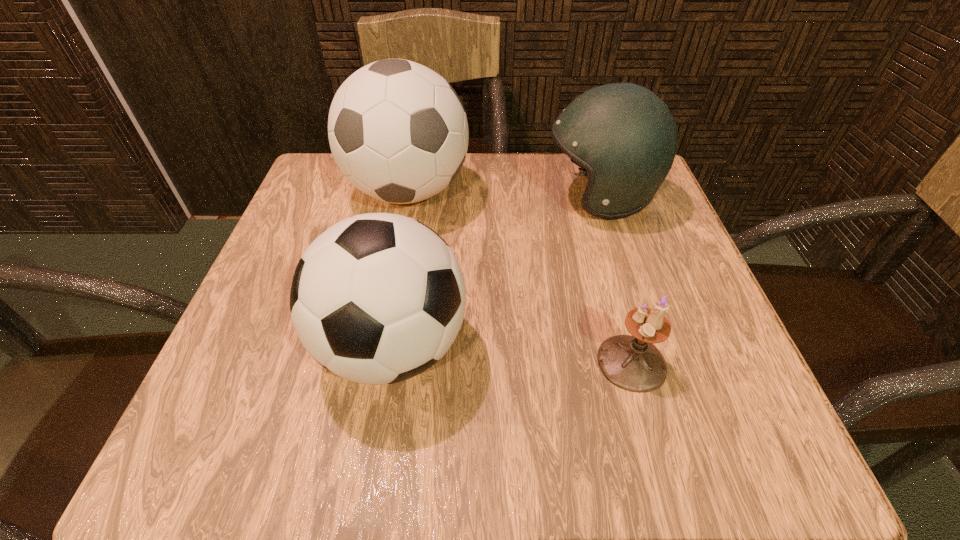
Locate an element on the screen. the farther soccer ball is located at coordinates (398, 131).

At what (x,y) coordinates should I click in order to perform the action: click on football helmet. Please return your answer as a coordinate pair (x, y). Looking at the image, I should click on (622, 134).

Where is `the shorter soccer ball`? the shorter soccer ball is located at coordinates (378, 298).

At what (x,y) coordinates should I click in order to perform the action: click on the shortest object. Please return your answer as a coordinate pair (x, y). Looking at the image, I should click on (633, 363).

Locate an element on the screen. vacant area situated on the right of the taller soccer ball is located at coordinates (493, 192).

The height and width of the screenshot is (540, 960). Identify the location of blank area located at the face opening of the football helmet. (353, 196).

Where is `free spot located 0.120m at the face opening of the football helmet`? Image resolution: width=960 pixels, height=540 pixels. free spot located 0.120m at the face opening of the football helmet is located at coordinates (487, 196).

This screenshot has width=960, height=540. I want to click on free spot located at the face opening of the football helmet, so click(x=501, y=196).

The width and height of the screenshot is (960, 540). In order to click on free space located 0.080m on the left of the nearer soccer ball in this screenshot , I will do `click(265, 347)`.

You are a GUI agent. You are given a task and a screenshot of the screen. Output one action in this format:
    pyautogui.click(x=<x>, y=<y>)
    Task: Click on the vacant space located on the back of the shortest object
    This screenshot has height=540, width=960.
    Given the screenshot: What is the action you would take?
    pyautogui.click(x=590, y=214)